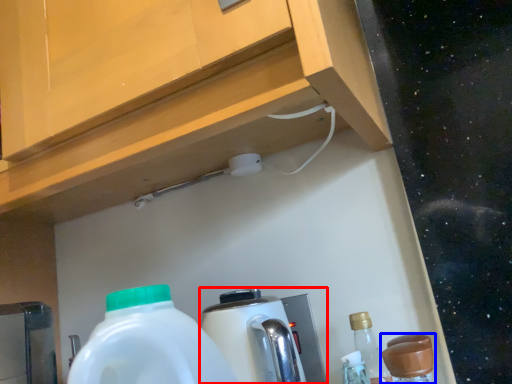
Question: Which point is further to the camera, coffee machine (highlighted by a red box) or bottle (highlighted by a blue box)?

Choices:
 (A) coffee machine
 (B) bottle

Answer: (A)